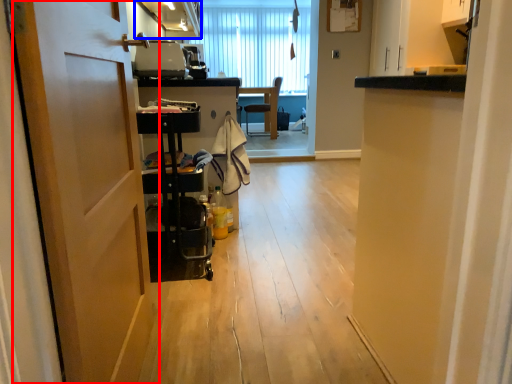
Question: Which object appears farthest to the camera in this image, door (highlighted by a red box) or cabinetry (highlighted by a blue box)?

Choices:
 (A) door
 (B) cabinetry

Answer: (B)